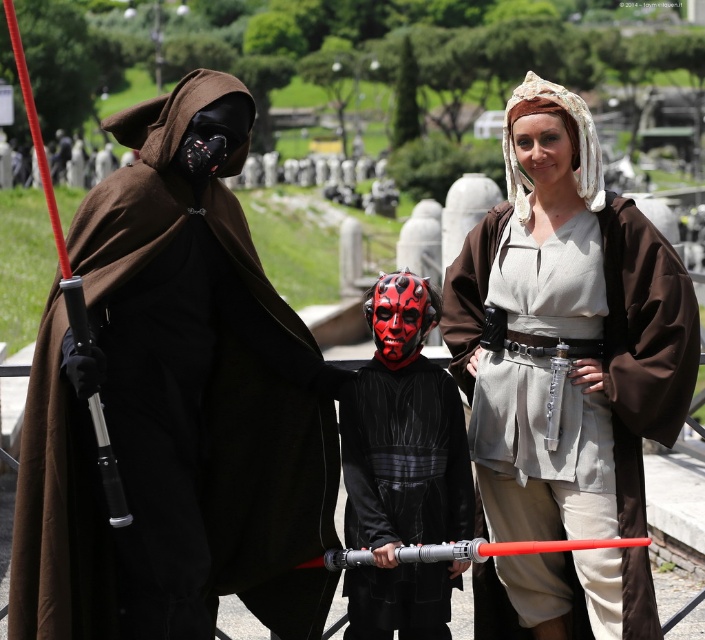
Does brown matte robe at left have a lesser height compared to matte brown robe at center?

Yes, brown matte robe at left is shorter than matte brown robe at center.

I want to click on brown matte robe at left, so click(173, 412).

Does point (110, 422) come farther from viewer compared to point (494, 426)?

No, (110, 422) is in front of (494, 426).

Identify the location of brown matte robe at left. (173, 412).

The height and width of the screenshot is (640, 705). What do you see at coordinates (173, 412) in the screenshot?
I see `brown matte robe at left` at bounding box center [173, 412].

Can you confirm if brown matte robe at left is positioned above black velvet robe at center?

Yes, brown matte robe at left is above black velvet robe at center.

Who is more forward, (x=63, y=312) or (x=419, y=618)?

Point (x=63, y=312) is in front.

I want to click on brown matte robe at left, so click(x=173, y=412).

Between point (649, 413) and point (345, 404), which one is positioned behind?

The point (345, 404) is behind.

The height and width of the screenshot is (640, 705). Describe the element at coordinates (565, 333) in the screenshot. I see `matte brown robe at center` at that location.

Who is more distant from viewer, (544, 211) or (369, 600)?

The point (544, 211) is behind.

This screenshot has height=640, width=705. I want to click on matte brown robe at center, so click(565, 333).